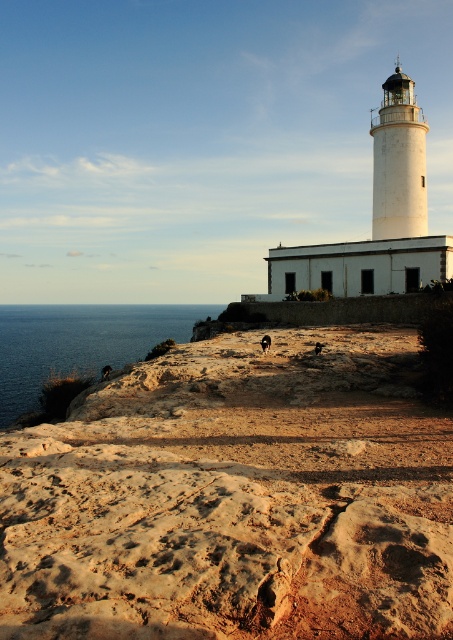
What do you see at coordinates (235, 499) in the screenshot? Image resolution: width=453 pixels, height=640 pixels. I see `rustic stone beach at center` at bounding box center [235, 499].

Does rustic stone beach at center appear on the left side of blue water at lower left?

No, rustic stone beach at center is not to the left of blue water at lower left.

The width and height of the screenshot is (453, 640). What do you see at coordinates (235, 499) in the screenshot?
I see `rustic stone beach at center` at bounding box center [235, 499].

Find the location of `rustic stone beach at center`. rustic stone beach at center is located at coordinates (235, 499).